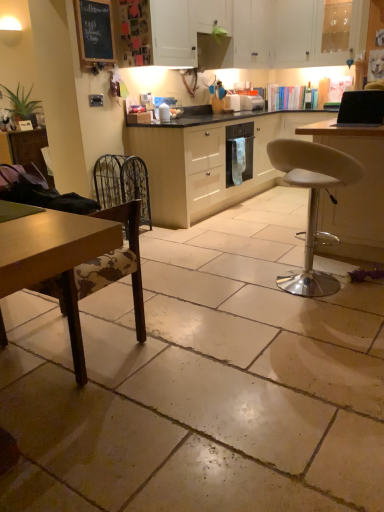
In order to click on free space behind wooden chair at lower left, which is counted as the 1th chair, starting from the left in this screenshot , I will do `click(113, 302)`.